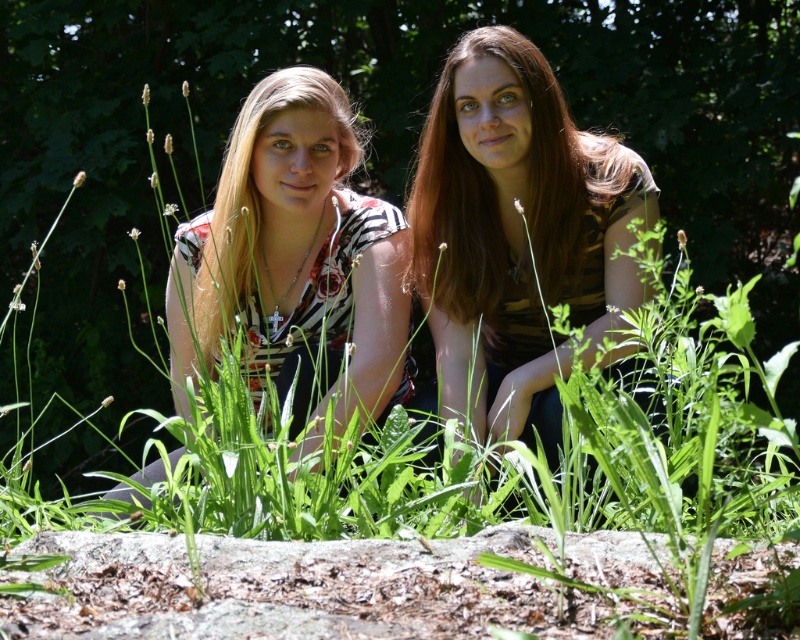
Question: Can you confirm if matte floral shirt at center is thinner than matte floral blouse at center?

Choices:
 (A) no
 (B) yes

Answer: (A)

Question: Which object appears closest to the camera in this image?

Choices:
 (A) matte floral blouse at center
 (B) matte floral shirt at center

Answer: (B)

Question: Is brown striped shirt at center thinner than matte floral blouse at center?

Choices:
 (A) yes
 (B) no

Answer: (B)

Question: Among these objects, which one is farthest from the camera?

Choices:
 (A) matte floral blouse at center
 (B) brown striped shirt at center
 (C) matte floral shirt at center

Answer: (A)

Question: Observing the image, what is the correct spatial positioning of brown striped shirt at center in reference to matte floral shirt at center?

Choices:
 (A) right
 (B) left

Answer: (A)

Question: Which object is closer to the camera taking this photo?

Choices:
 (A) matte floral blouse at center
 (B) brown striped shirt at center

Answer: (B)